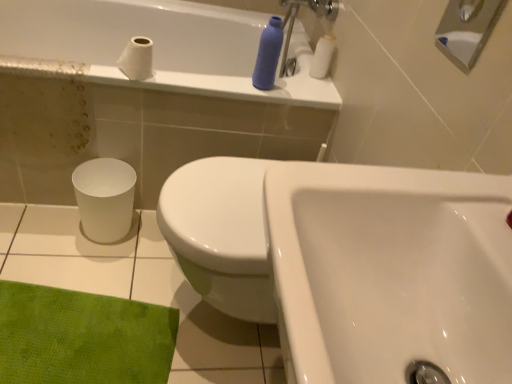
Question: Should I look upward or downward to see white matte toilet paper at upper left, marked as the 2th toilet paper in a right-to-left arrangement?

Choices:
 (A) up
 (B) down

Answer: (A)

Question: Is white glossy bathtub at upper center positioned behind white glossy sink at center?

Choices:
 (A) yes
 (B) no

Answer: (A)

Question: From the image's perspective, would you say white glossy bathtub at upper center is positioned over white glossy sink at center?

Choices:
 (A) no
 (B) yes

Answer: (B)

Question: From a real-world perspective, is white glossy bathtub at upper center over white glossy sink at center?

Choices:
 (A) yes
 (B) no

Answer: (B)

Question: Can you confirm if white glossy bathtub at upper center is positioned to the left of white glossy sink at center?

Choices:
 (A) yes
 (B) no

Answer: (A)

Question: Is white glossy bathtub at upper center positioned beyond the bounds of white glossy sink at center?

Choices:
 (A) no
 (B) yes

Answer: (B)

Question: Considering the relative sizes of white glossy bathtub at upper center and white glossy sink at center in the image provided, is white glossy bathtub at upper center wider than white glossy sink at center?

Choices:
 (A) yes
 (B) no

Answer: (A)

Question: Can you confirm if white matte toilet paper at upper right, the first toilet paper viewed from the right, is bigger than white ceramic tile at lower left?

Choices:
 (A) no
 (B) yes

Answer: (A)

Question: From the image's perspective, is white matte toilet paper at upper right, which ranks as the 2th toilet paper in left-to-right order, over white ceramic tile at lower left?

Choices:
 (A) no
 (B) yes

Answer: (B)

Question: Is white matte toilet paper at upper right, which ranks as the 2th toilet paper in left-to-right order, oriented towards white ceramic tile at lower left?

Choices:
 (A) yes
 (B) no

Answer: (B)

Question: Could white ceramic tile at lower left be considered to be inside white matte toilet paper at upper right, the first toilet paper viewed from the right?

Choices:
 (A) yes
 (B) no

Answer: (B)

Question: Is white matte toilet paper at upper right, which is the 1th toilet paper from back to front, to the left of white ceramic tile at lower left from the viewer's perspective?

Choices:
 (A) yes
 (B) no

Answer: (B)

Question: Is white matte toilet paper at upper right, the second toilet paper positioned from the front, outside of white ceramic tile at lower left?

Choices:
 (A) yes
 (B) no

Answer: (A)

Question: Is white ceramic tile at lower left not near matte plastic bottle at upper center?

Choices:
 (A) yes
 (B) no

Answer: (B)